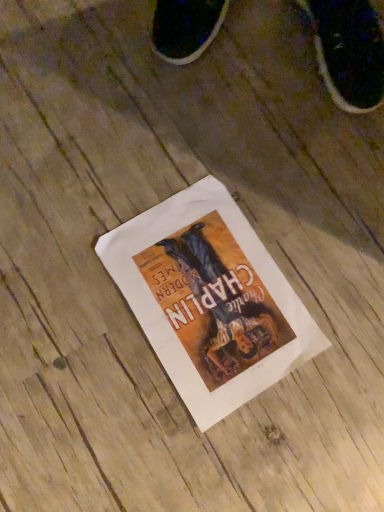
What do you see at coordinates (210, 300) in the screenshot? The width and height of the screenshot is (384, 512). I see `white paper at center` at bounding box center [210, 300].

You are a GUI agent. You are given a task and a screenshot of the screen. Output one action in this format:
    pyautogui.click(x=<x>, y=<y>)
    Task: Click on the white paper at center
    The height and width of the screenshot is (512, 384).
    Given the screenshot: What is the action you would take?
    pyautogui.click(x=210, y=300)

This screenshot has height=512, width=384. Find the location of `white paper at center`. white paper at center is located at coordinates (210, 300).